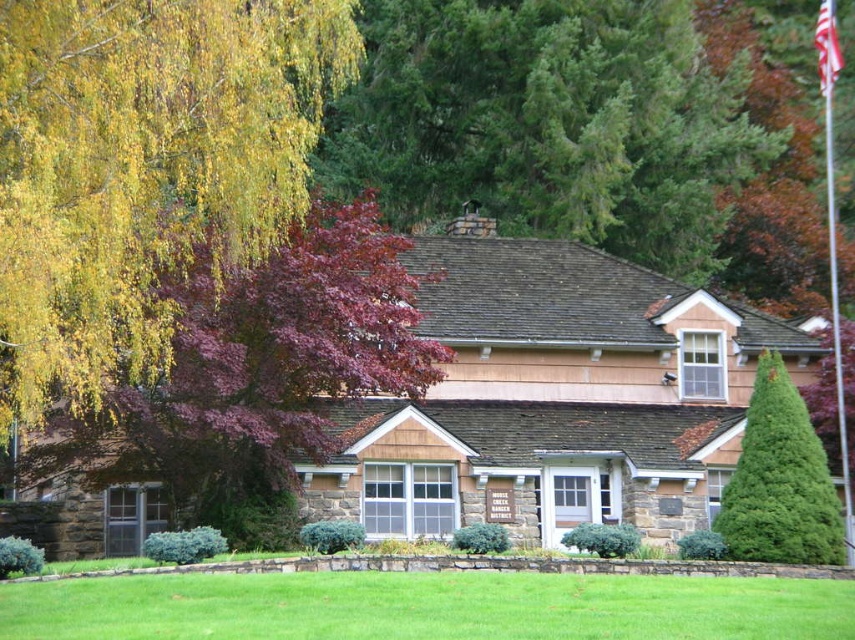
You are standing in front of the house and see the yellow leafy tree at upper left and the red fabric flag at upper right. Which object is located to the left of the other?

The yellow leafy tree at upper left is positioned on the left side of red fabric flag at upper right.

You are standing in front of the house and want to take a photo of the yellow leafy tree at upper left. Based on its position, where should you aim your camera?

The yellow leafy tree at upper left is located at point 0.263 on the horizontal axis and 0.167 on the vertical axis, so you should aim your camera towards the upper left area of the scene.